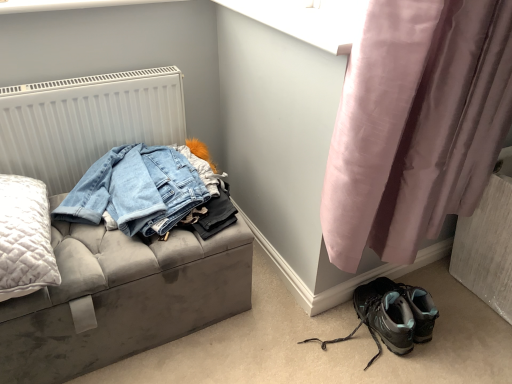
Locate an element on the screen. The width and height of the screenshot is (512, 384). vacant area that lies to the right of matte black hiking boots at lower right is located at coordinates (438, 352).